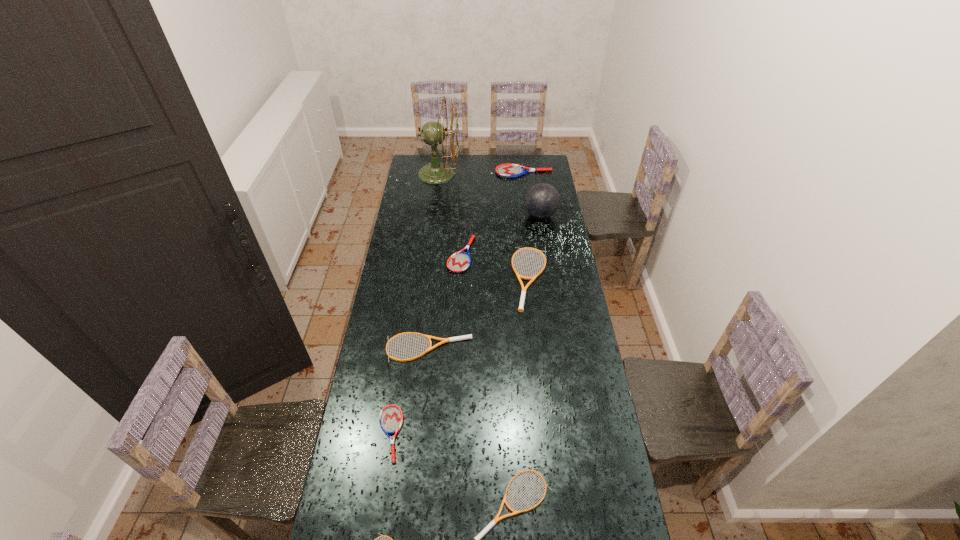
Find the location of a particular element. Image resolution: width=960 pixels, height=540 pixels. the third nearest tennis racket is located at coordinates (391, 417).

Where is `the leftmost blue tennis racket`? Image resolution: width=960 pixels, height=540 pixels. the leftmost blue tennis racket is located at coordinates (391, 417).

You are a GUI agent. You are given a task and a screenshot of the screen. Output one action in this format:
    pyautogui.click(x=<x>, y=<y>)
    Task: Click on the vacant space located in front of the tallest object, directing air flow
    This screenshot has width=960, height=540.
    Given the screenshot: What is the action you would take?
    click(x=520, y=174)

The image size is (960, 540). Identify the location of blank space located 0.090m on the grip area of the seventh nearest object. (507, 215).

Identify the location of vacant area situated 0.120m on the grip area of the seventh nearest object. (501, 215).

Where is `free space located on the grip area of the seventh nearest object`? Image resolution: width=960 pixels, height=540 pixels. free space located on the grip area of the seventh nearest object is located at coordinates (501, 215).

Image resolution: width=960 pixels, height=540 pixels. What are the coordinates of `vacant space located 0.170m on the back of the farthest beige tennis racket` in the screenshot? It's located at (526, 227).

Where is `free space located on the front of the rightmost blue tennis racket`? The width and height of the screenshot is (960, 540). free space located on the front of the rightmost blue tennis racket is located at coordinates (525, 186).

At what (x,y) coordinates should I click in order to perform the action: click on vacant region located 0.060m on the front of the fourth farthest tennis racket. Please return your answer as a coordinate pair (x, y). The width and height of the screenshot is (960, 540). Looking at the image, I should click on pos(426,377).

In order to click on vacant space located on the front of the second biggest blue tennis racket in this screenshot , I will do `click(461, 281)`.